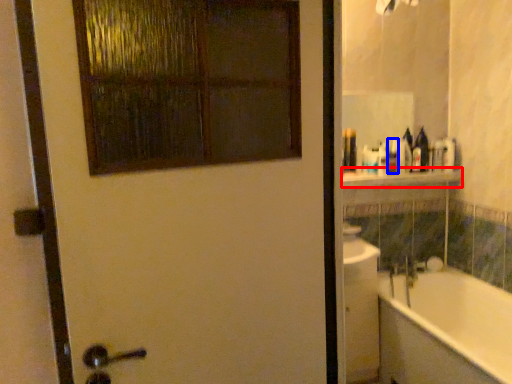
Question: Among these objects, which one is farthest to the camera, balustrade (highlighted by a red box) or toiletry (highlighted by a blue box)?

Choices:
 (A) balustrade
 (B) toiletry

Answer: (B)